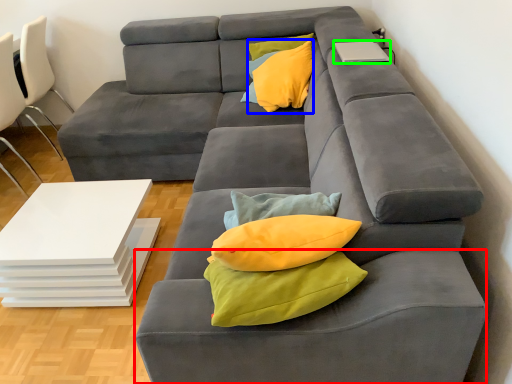
Question: Considering the real-world distances, which object is closest to footrest (highlighted by a red box)? throw pillow (highlighted by a blue box) or laptop (highlighted by a green box).

Choices:
 (A) throw pillow
 (B) laptop

Answer: (B)